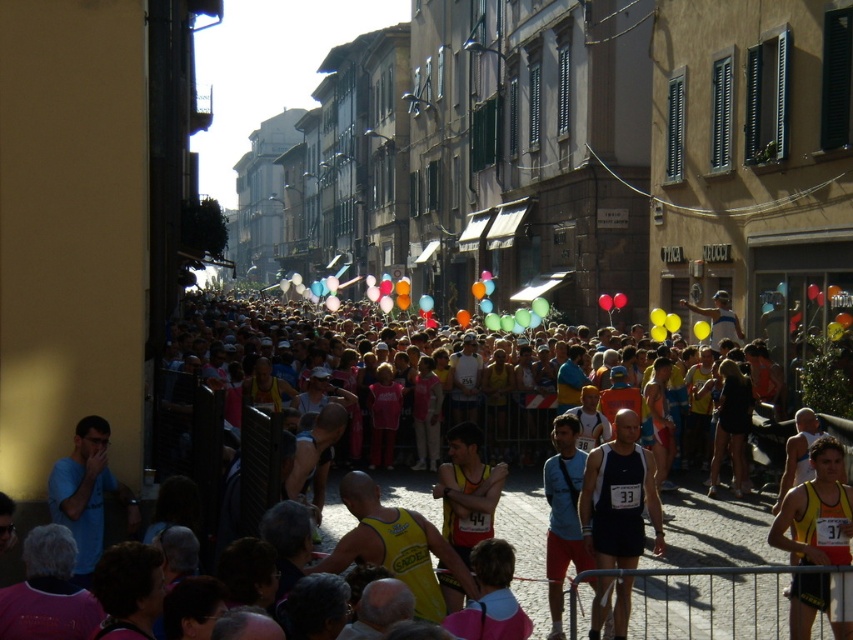
You are a photographer positioned at the starting line of the marathon, aiming to capture a closeup shot of the dark blue athletic tank top at center. Your camera has a maximum focus range of 20 meters. Can you capture the tank top clearly with your current settings?

The dark blue athletic tank top at center is 21.66 meters away from the viewer, which exceeds the camera maximum focus range of 20 meters. Therefore, you cannot capture the tank top clearly with your current settings.

You are a photographer positioned at the starting line of the marathon. You want to capture a photo of both the dark blue athletic tank top at center and the yellow fabric tank top at center. Which runner should you focus on first to ensure both are in the frame?

You should focus on the yellow fabric tank top at center first because the dark blue athletic tank top at center is to the left of it, so by centering the yellow one, the blue one will naturally be included in the frame to its left.